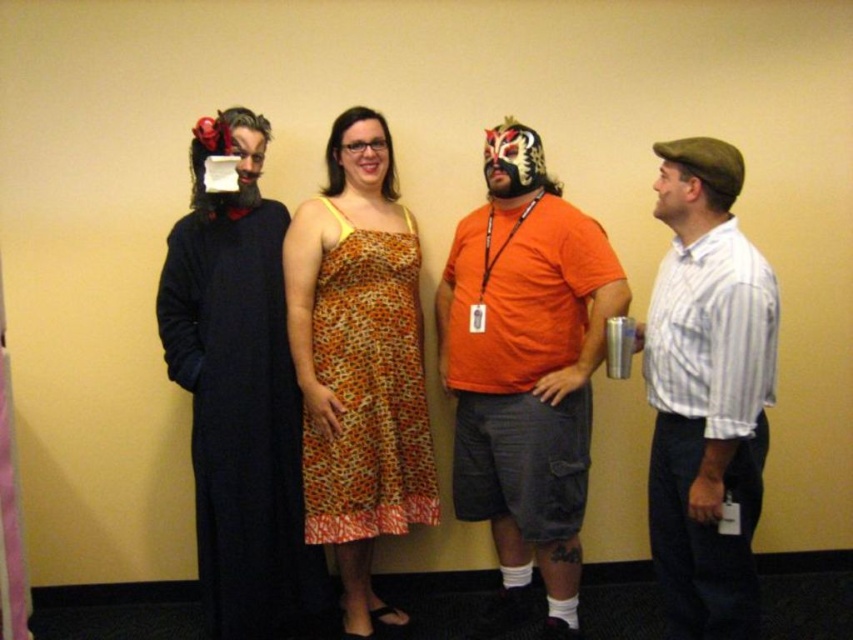
You are standing in front of the four people in the image. Based on their positions, which of the two points, point 1 at coordinates point (585, 296) or point 2 at coordinates point (711, 234), is closer to you?

Answer: Point 2 at coordinates point (711, 234) is closer to you because it is in front of point 1 at coordinates point (585, 296).

You are standing in front of the two orange garments, the orange cotton shirt at center and the orange printed fabric dress at center. Which one is nearer to you?

The orange cotton shirt at center is closer to the viewer than the orange printed fabric dress at center.